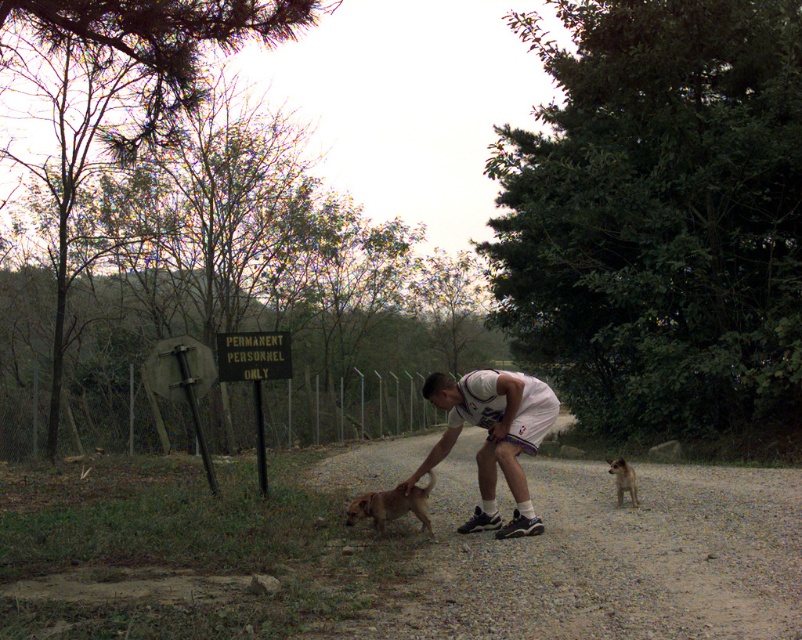
You are a hiker who wants to follow the dirt gravel road at center to reach a campsite. However, there is a green plastic sign at center nearby. Which direction should you go relative to the sign to stay on the road?

The dirt gravel road at center is positioned on the right side of green plastic sign at center, so you should go to the right of the sign to stay on the road.

You are standing at the point marked as point (592, 502) in the image. If you want to walk back to the starting point, which direction should you head?

Since point (592, 502) is 9.84 meters from the viewer, you should walk towards the direction opposite to where the point is located to return to the starting position.

You are a delivery person who needs to walk along the dirt gravel road at center while avoiding stepping on the fuzzy brown dog at lower right. Can you safely walk on the road without stepping on the dog?

The dirt gravel road at center is wider than the fuzzy brown dog at lower right, so yes, you can safely walk on the road without stepping on the dog.